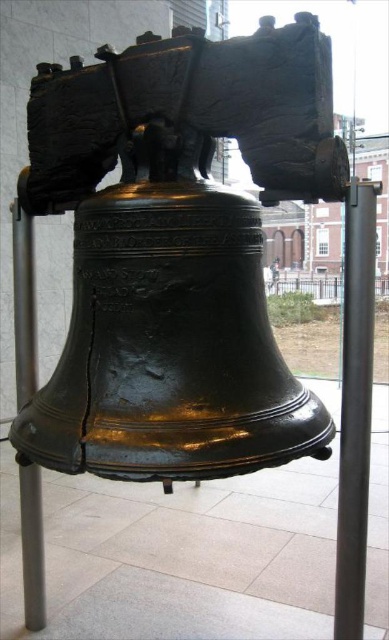
You are standing in front of the Liberty Bell exhibit and want to take a photo of the bell without any obstructions. There is a black metal pole at right in the way. Based on its 2D location coordinates, can you estimate whether the pole will block your view of the bell?

The black metal pole at right is located at coordinates point (x=355, y=406), which is likely positioned to the side and lower portion of the frame. Since the Liberty Bell itself is centrally displayed within the glass enclosure, the pole may not obstruct the central view of the bell. However, depending on your exact camera angle and positioning, you might need to adjust your stance to avoid the pole blocking the shot.

You are standing in front of the Liberty Bell and notice two points marked on the bell. The first point is at coordinates point (x=348, y=392) and the second is at point (x=15, y=243). Which point is closer to you?

Point (x=348, y=392) is in front of point 0.381, 0.39, so the first point is closer to you.

You are standing in front of the Liberty Bell and notice two black metal poles supporting its enclosure. Which of the two poles, the black metal pole at right or the black metal pole at lower left, is taller?

The black metal pole at right is taller than the black metal pole at lower left.